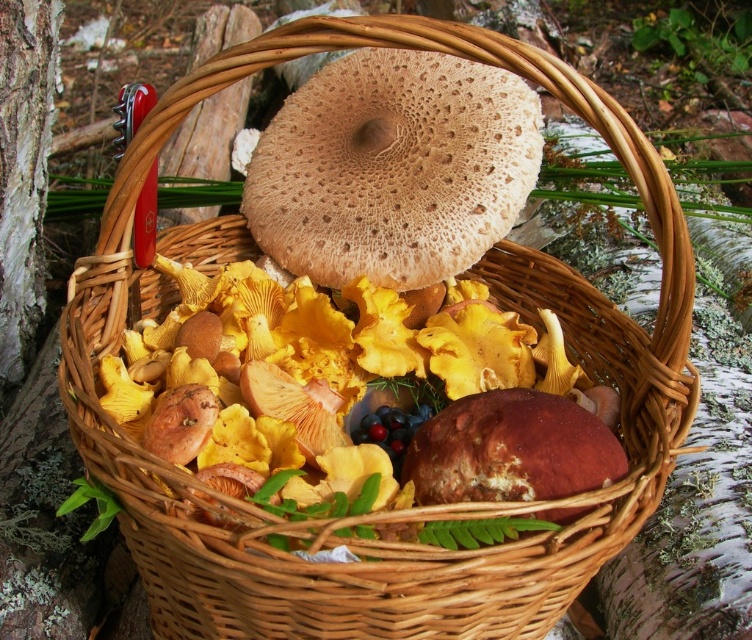
You are a squirrel looking for food in the forest. You see the white bark at left and the shiny purple grapes at center. Which one is taller?

The white bark at left is taller than the shiny purple grapes at center.

You are a mycologist examining the basket of mushrooms. You notice a point at coordinates point (356, 396). What does this point represent?

The point at point (356, 396) represents the yellow golden flesh at center.